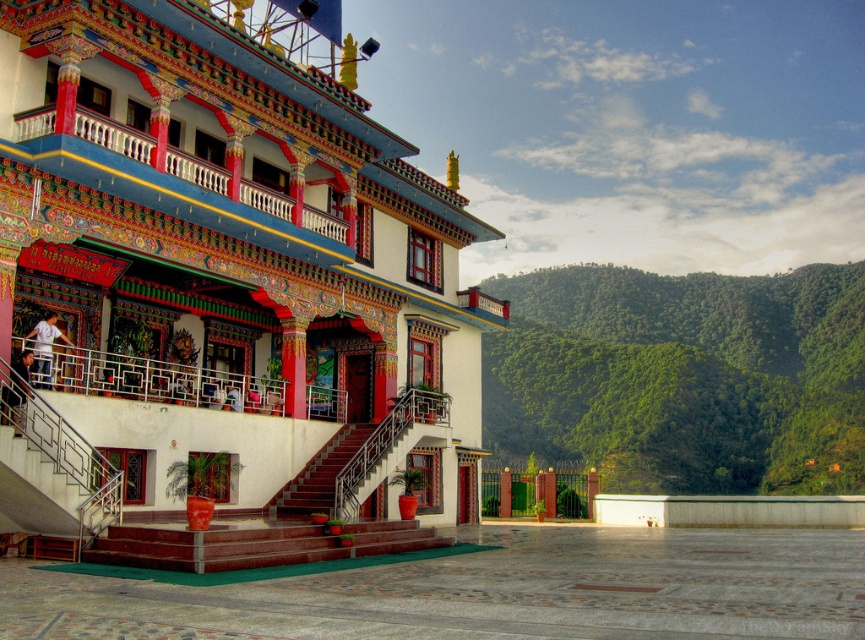
Question: Which of the following is the closest to the observer?

Choices:
 (A) (29, 332)
 (B) (681, 332)
 (C) (43, 161)

Answer: (C)

Question: Is white painted wall at center to the left of maroon wooden stairs at center from the viewer's perspective?

Choices:
 (A) yes
 (B) no

Answer: (A)

Question: Does green leafy hillside at upper right lie in front of white cotton shirt at upper left?

Choices:
 (A) yes
 (B) no

Answer: (B)

Question: Estimate the real-world distances between objects in this image. Which object is closer to the maroon wooden stairs at center?

Choices:
 (A) white cotton shirt at upper left
 (B) metallic staircase at lower left

Answer: (A)

Question: Does white painted wall at center appear over maroon wooden stairs at center?

Choices:
 (A) yes
 (B) no

Answer: (A)

Question: Considering the real-world distances, which object is farthest from the green leafy hillside at upper right?

Choices:
 (A) maroon wooden stairs at center
 (B) white painted wall at center
 (C) white cotton shirt at upper left

Answer: (C)